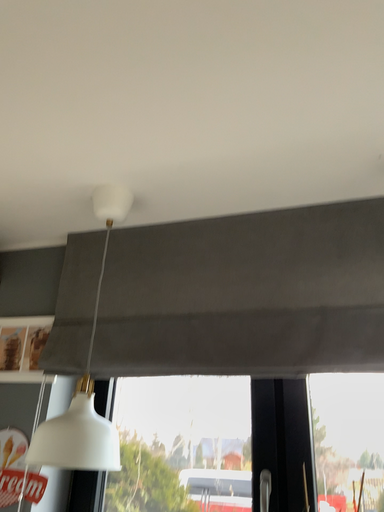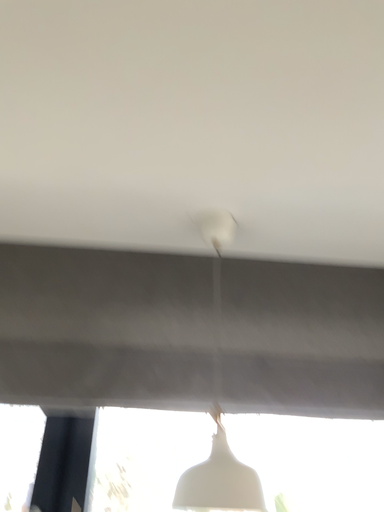
Question: How did the camera likely rotate when shooting the video?

Choices:
 (A) rotated left
 (B) rotated right

Answer: (B)